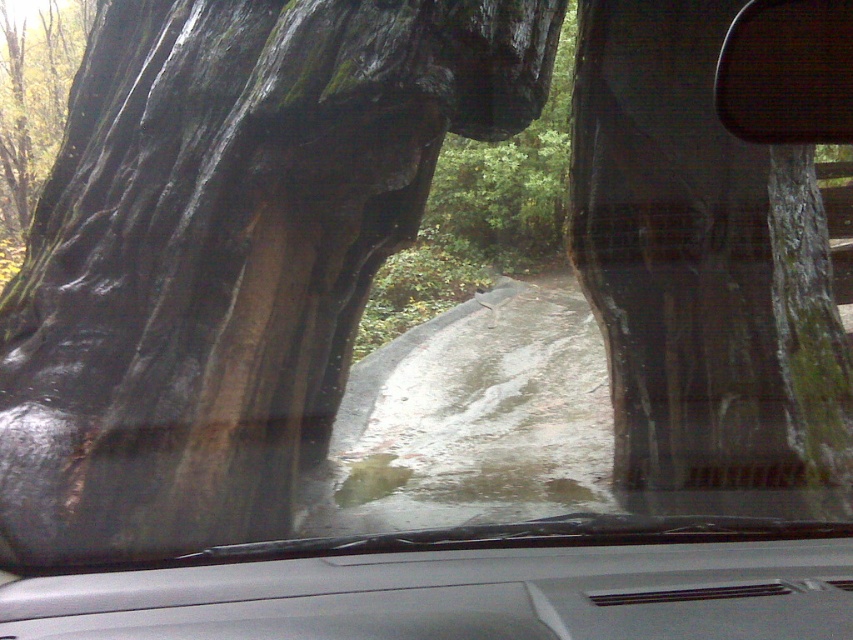
Question: Which of the following is the closest to the observer?

Choices:
 (A) green rough bark at upper left
 (B) green mossy bark at right

Answer: (B)

Question: Where is green mossy bark at right located in relation to green rough bark at upper left in the image?

Choices:
 (A) below
 (B) above

Answer: (A)

Question: Which object is farther from the camera taking this photo?

Choices:
 (A) green rough bark at upper left
 (B) green mossy bark at right

Answer: (A)

Question: Is green mossy bark at right below green rough bark at upper left?

Choices:
 (A) yes
 (B) no

Answer: (A)

Question: Does green mossy bark at right have a larger size compared to green rough bark at upper left?

Choices:
 (A) yes
 (B) no

Answer: (A)